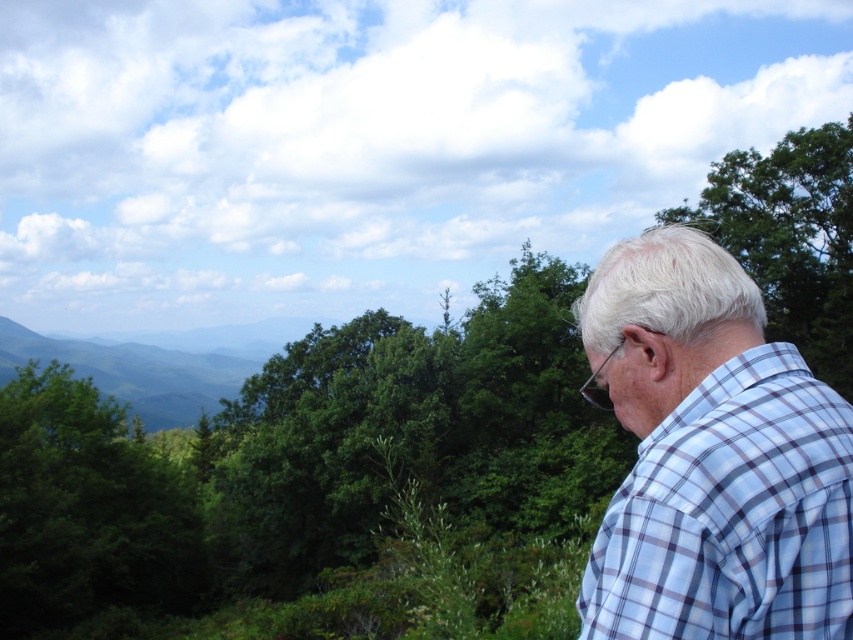
Question: Considering the relative positions of green leafy tree at left and green leafy tree at upper right in the image provided, where is green leafy tree at left located with respect to green leafy tree at upper right?

Choices:
 (A) left
 (B) right

Answer: (A)

Question: Is light blue plaid shirt at right below green leafy tree at left?

Choices:
 (A) yes
 (B) no

Answer: (B)

Question: Which point is closer to the camera taking this photo?

Choices:
 (A) (30, 412)
 (B) (790, 220)

Answer: (A)

Question: Can you confirm if light blue plaid shirt at right is smaller than green leafy tree at upper right?

Choices:
 (A) no
 (B) yes

Answer: (B)

Question: Which object is the farthest from the light blue plaid shirt at right?

Choices:
 (A) green leafy tree at left
 (B) green leafy tree at upper right

Answer: (B)

Question: Among these points, which one is farthest from the camera?

Choices:
 (A) (849, 340)
 (B) (105, 484)

Answer: (A)